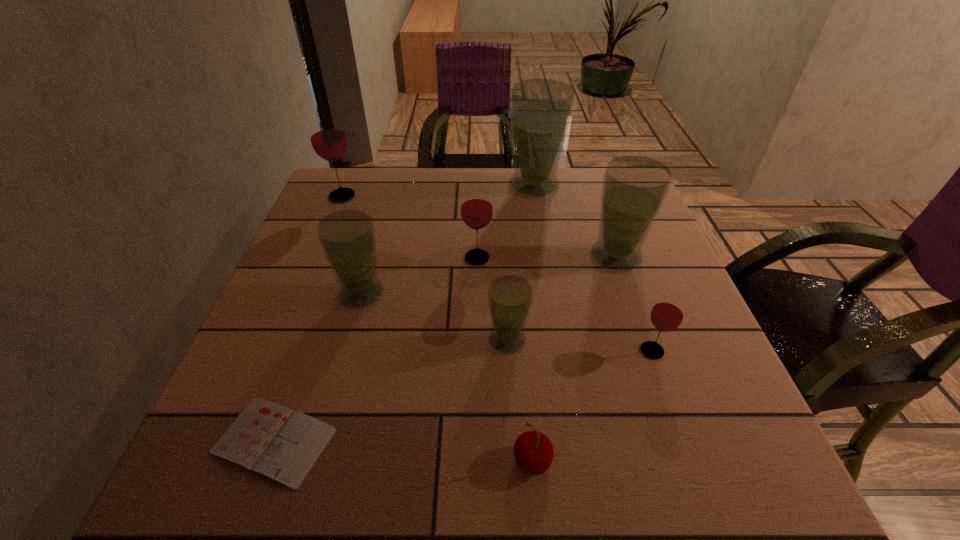
This screenshot has height=540, width=960. I want to click on free space that is in between the nearest blue glass and the red cherry, so click(x=519, y=400).

The image size is (960, 540). I want to click on unoccupied position between the rightmost blue glass and the red cherry, so click(x=574, y=359).

Locate an element on the screen. This screenshot has width=960, height=540. empty location between the tallest object and the farthest red glass is located at coordinates (439, 191).

This screenshot has width=960, height=540. In order to click on vacant space that's between the tallest object and the smallest blue glass in this screenshot , I will do `click(520, 262)`.

This screenshot has height=540, width=960. In order to click on the fourth closest object to the nearest blue glass in this screenshot , I will do `click(634, 188)`.

The image size is (960, 540). In order to click on object that is the seventh closest to the biggest blue glass in this screenshot , I will do `click(273, 440)`.

The height and width of the screenshot is (540, 960). What are the coordinates of `glass identified as the second closest to the red cherry` in the screenshot? It's located at (667, 314).

Choose which glass is the sixth nearest neighbor to the tallest glass. Please provide its 2D coordinates. Your answer should be formatted as a tuple, i.e. [(x, y)], where the tuple contains the x and y coordinates of a point satisfying the conditions above.

[(667, 314)]

Find the location of a particular element. blue glass that is the second nearest to the second biggest blue glass is located at coordinates 510,297.

At what (x,y) coordinates should I click in order to perform the action: click on the fourth closest blue glass to the eighth tallest object. Please return your answer as a coordinate pair (x, y). The image size is (960, 540). Looking at the image, I should click on (541, 109).